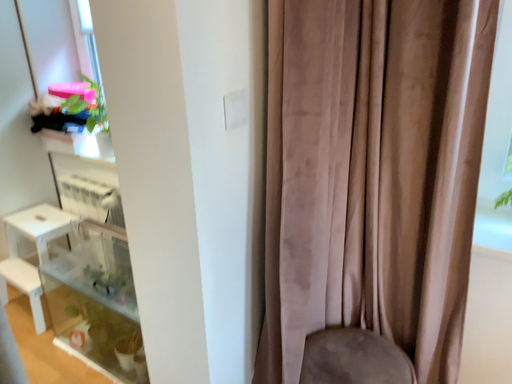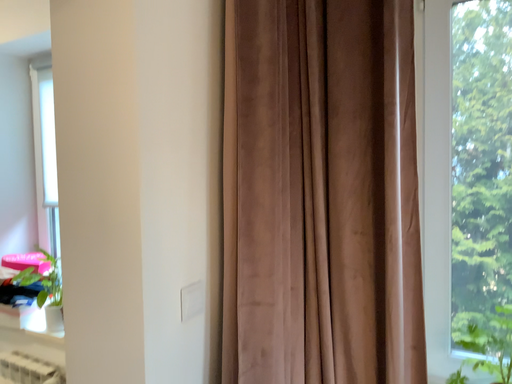
Question: How did the camera likely rotate when shooting the video?

Choices:
 (A) rotated upward
 (B) rotated downward

Answer: (A)